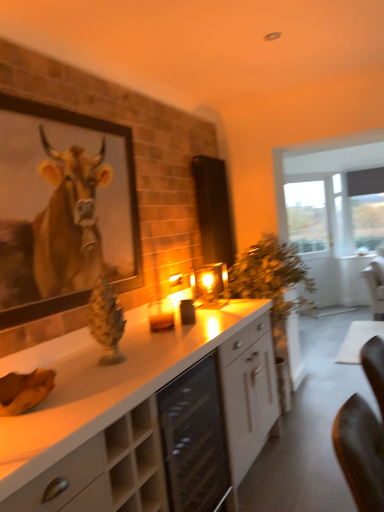
The width and height of the screenshot is (384, 512). Describe the element at coordinates (367, 206) in the screenshot. I see `matte gray curtain at right` at that location.

Find the location of a particular element. white glossy cabinet at center, positioned as the first cabinetry in back-to-front order is located at coordinates (137, 416).

Describe the element at coordinates (313, 231) in the screenshot. I see `transparent glass door at right` at that location.

At what (x,y) coordinates should I click in order to perform the action: click on beige wood cabinet at lower left, the second cabinetry positioned from the back. Please return your answer as a coordinate pair (x, y). Looking at the image, I should click on (104, 471).

Can you confirm if matte black screen door at center is shorter than white glossy cabinet at center, positioned as the first cabinetry in back-to-front order?

No.

Is matte black screen door at center thinner than white glossy cabinet at center, acting as the 2th cabinetry starting from the front?

Correct, the width of matte black screen door at center is less than that of white glossy cabinet at center, acting as the 2th cabinetry starting from the front.

From a real-world perspective, is matte black screen door at center under white glossy cabinet at center, positioned as the first cabinetry in back-to-front order?

No, from a real-world perspective, matte black screen door at center is not under white glossy cabinet at center, positioned as the first cabinetry in back-to-front order.

From the image's perspective, is matte black screen door at center positioned above or below white glossy cabinet at center, acting as the 2th cabinetry starting from the front?

matte black screen door at center is situated higher than white glossy cabinet at center, acting as the 2th cabinetry starting from the front, in the image.

Can you confirm if beige wood cabinet at lower left, which ranks as the first cabinetry in front-to-back order, is thinner than white glossy cabinet at center, positioned as the first cabinetry in back-to-front order?

In fact, beige wood cabinet at lower left, which ranks as the first cabinetry in front-to-back order, might be wider than white glossy cabinet at center, positioned as the first cabinetry in back-to-front order.

Would you say white glossy cabinet at center, positioned as the first cabinetry in back-to-front order, is part of beige wood cabinet at lower left, the second cabinetry positioned from the back,'s contents?

Definitely not — white glossy cabinet at center, positioned as the first cabinetry in back-to-front order, is not inside beige wood cabinet at lower left, the second cabinetry positioned from the back.

Is there a large distance between beige wood cabinet at lower left, the second cabinetry positioned from the back, and white glossy cabinet at center, acting as the 2th cabinetry starting from the front?

No, beige wood cabinet at lower left, the second cabinetry positioned from the back, is not far from white glossy cabinet at center, acting as the 2th cabinetry starting from the front.

Considering the relative positions of beige wood cabinet at lower left, which ranks as the first cabinetry in front-to-back order, and white glossy cabinet at center, positioned as the first cabinetry in back-to-front order, in the image provided, is beige wood cabinet at lower left, which ranks as the first cabinetry in front-to-back order, to the right of white glossy cabinet at center, positioned as the first cabinetry in back-to-front order, from the viewer's perspective?

No, beige wood cabinet at lower left, which ranks as the first cabinetry in front-to-back order, is not to the right of white glossy cabinet at center, positioned as the first cabinetry in back-to-front order.

From the image's perspective, is matte black screen door at center located beneath matte gray curtain at right?

Yes, from the image's perspective, matte black screen door at center is below matte gray curtain at right.

You are a GUI agent. You are given a task and a screenshot of the screen. Output one action in this format:
    pyautogui.click(x=<x>, y=<y>)
    Task: Click on the screen door below the matte gray curtain at right (from a real-world perspective)
    
    Given the screenshot: What is the action you would take?
    pyautogui.click(x=213, y=210)

Looking at this image, from a real-world perspective, is matte black screen door at center beneath matte gray curtain at right?

Correct, in the physical world, matte black screen door at center is lower than matte gray curtain at right.

Considering the positions of objects white glossy cabinet at center, acting as the 2th cabinetry starting from the front, and beige wood cabinet at lower left, which ranks as the first cabinetry in front-to-back order, in the image provided, who is in front, white glossy cabinet at center, acting as the 2th cabinetry starting from the front, or beige wood cabinet at lower left, which ranks as the first cabinetry in front-to-back order,?

beige wood cabinet at lower left, which ranks as the first cabinetry in front-to-back order, is in front.

Considering the relative positions of white glossy cabinet at center, acting as the 2th cabinetry starting from the front, and beige wood cabinet at lower left, which ranks as the first cabinetry in front-to-back order, in the image provided, is white glossy cabinet at center, acting as the 2th cabinetry starting from the front, to the right of beige wood cabinet at lower left, which ranks as the first cabinetry in front-to-back order, from the viewer's perspective?

Yes.

From a real-world perspective, which object rests below the other?

white glossy cabinet at center, acting as the 2th cabinetry starting from the front.

Based on the photo, would you say white glossy cabinet at center, positioned as the first cabinetry in back-to-front order, is inside or outside matte gray curtain at right?

white glossy cabinet at center, positioned as the first cabinetry in back-to-front order, is not enclosed by matte gray curtain at right.

Is point (32, 495) farther from camera compared to point (348, 176)?

No, it is not.

Does white glossy cabinet at center, acting as the 2th cabinetry starting from the front, have a larger size compared to matte gray curtain at right?

Yes, white glossy cabinet at center, acting as the 2th cabinetry starting from the front, is bigger than matte gray curtain at right.

Is the surface of white glossy cabinet at center, acting as the 2th cabinetry starting from the front, in direct contact with matte gray curtain at right?

No, white glossy cabinet at center, acting as the 2th cabinetry starting from the front, is not in contact with matte gray curtain at right.

Which object is thinner, white glossy cabinet at center, acting as the 2th cabinetry starting from the front, or wooden framed cow portrait at upper left?

wooden framed cow portrait at upper left.

Is white glossy cabinet at center, acting as the 2th cabinetry starting from the front, taller or shorter than wooden framed cow portrait at upper left?

In the image, white glossy cabinet at center, acting as the 2th cabinetry starting from the front, appears to be shorter than wooden framed cow portrait at upper left.

Does white glossy cabinet at center, positioned as the first cabinetry in back-to-front order, appear on the left side of wooden framed cow portrait at upper left?

No.

This screenshot has height=512, width=384. In order to click on cabinetry behind the wooden framed cow portrait at upper left in this screenshot , I will do `click(137, 416)`.

From the image's perspective, would you say transparent glass door at right is shown under matte gray curtain at right?

Indeed, from the image's perspective, transparent glass door at right is shown beneath matte gray curtain at right.

Is matte gray curtain at right at the back of transparent glass door at right?

No.

This screenshot has height=512, width=384. Identify the location of glass door lying on the left of matte gray curtain at right. (313, 231).

Who is bigger, transparent glass door at right or matte gray curtain at right?

transparent glass door at right.

This screenshot has height=512, width=384. Identify the location of screen door that is above the white glossy cabinet at center, positioned as the first cabinetry in back-to-front order (from the image's perspective). (213, 210).

Where is `cabinetry on the left of white glossy cabinet at center, positioned as the first cabinetry in back-to-front order`? Image resolution: width=384 pixels, height=512 pixels. cabinetry on the left of white glossy cabinet at center, positioned as the first cabinetry in back-to-front order is located at coordinates (104, 471).

Based on the photo, based on their spatial positions, is beige wood cabinet at lower left, the second cabinetry positioned from the back, or transparent glass door at right further from wooden framed cow portrait at upper left?

transparent glass door at right lies further to wooden framed cow portrait at upper left than the other object.

Based on the photo, estimate the real-world distances between objects in this image. Which object is further from wooden framed cow portrait at upper left, matte black screen door at center or matte gray curtain at right?

The object further to wooden framed cow portrait at upper left is matte gray curtain at right.

Estimate the real-world distances between objects in this image. Which object is closer to wooden framed cow portrait at upper left, matte gray curtain at right or matte black screen door at center?

Based on the image, matte black screen door at center appears to be nearer to wooden framed cow portrait at upper left.

Looking at the image, which one is located further to matte black screen door at center, beige wood cabinet at lower left, the second cabinetry positioned from the back, or wooden framed cow portrait at upper left?

beige wood cabinet at lower left, the second cabinetry positioned from the back, lies further to matte black screen door at center than the other object.

Considering their positions, is wooden framed cow portrait at upper left positioned closer to transparent glass door at right than matte gray curtain at right?

The object closer to transparent glass door at right is matte gray curtain at right.

Considering their positions, is transparent glass door at right positioned closer to beige wood cabinet at lower left, the second cabinetry positioned from the back, than matte black screen door at center?

The object closer to beige wood cabinet at lower left, the second cabinetry positioned from the back, is matte black screen door at center.

Estimate the real-world distances between objects in this image. Which object is further from wooden framed cow portrait at upper left, transparent glass door at right or beige wood cabinet at lower left, the second cabinetry positioned from the back?

transparent glass door at right.

Based on their spatial positions, is wooden framed cow portrait at upper left or matte gray curtain at right closer to white glossy cabinet at center, positioned as the first cabinetry in back-to-front order?

The object closer to white glossy cabinet at center, positioned as the first cabinetry in back-to-front order, is wooden framed cow portrait at upper left.

Find the location of a particular element. Image resolution: width=384 pixels, height=512 pixels. picture frame between beige wood cabinet at lower left, which ranks as the first cabinetry in front-to-back order, and matte black screen door at center in the front-back direction is located at coordinates (63, 209).

Find the location of a particular element. screen door between wooden framed cow portrait at upper left and transparent glass door at right in the front-back direction is located at coordinates (213, 210).

This screenshot has height=512, width=384. I want to click on glass door between beige wood cabinet at lower left, which ranks as the first cabinetry in front-to-back order, and matte gray curtain at right, along the z-axis, so click(313, 231).

Find the location of `cabinetry between beige wood cabinet at lower left, which ranks as the first cabinetry in front-to-back order, and transparent glass door at right from front to back`. cabinetry between beige wood cabinet at lower left, which ranks as the first cabinetry in front-to-back order, and transparent glass door at right from front to back is located at coordinates (137, 416).